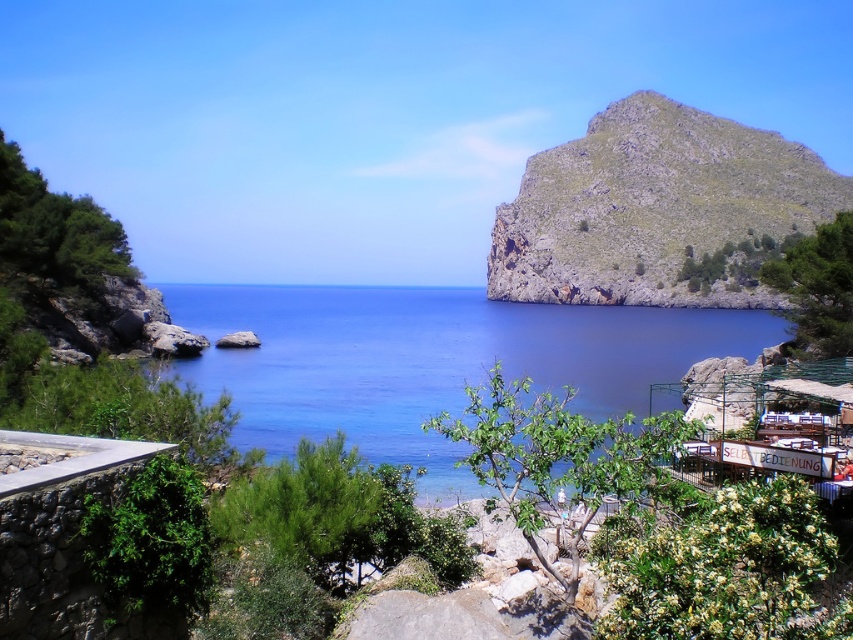
You are standing at the viewpoint in the coastal landscape and see two points marked in the image. The first point is at coordinate point (395, 433) and the second point is at coordinate point (602, 259). Which of these two points is closer to you?

Point (395, 433) is in front of point (602, 259), so it is closer to you.

Based on the photo, you are an artist planning to paint this coastal scene. You want to ensure the blue water at center and the green rocky hillside at upper right are proportionally accurate. Which object should you paint first if you want to allocate more canvas space to the larger one?

The green rocky hillside at upper right should be painted first because it occupies more space than the blue water at center according to the description.

You are a hiker who wants to cross from the blue water at center to the green rocky hillside at upper right. Given that your hiking boots can handle a maximum distance of 300 feet, can you safely make this journey?

The distance between the blue water at center and the green rocky hillside at upper right is 334.71 feet, which exceeds the maximum distance your hiking boots can handle. Therefore, you cannot safely make this journey.